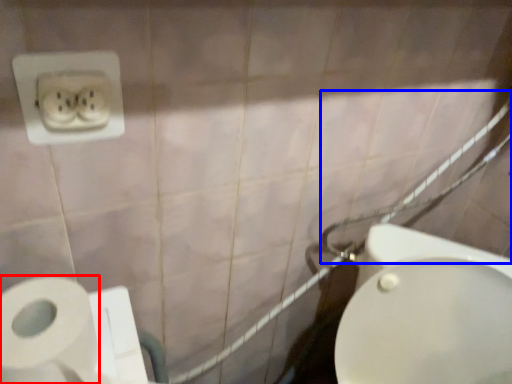
Question: Among these objects, which one is farthest to the camera, toilet paper (highlighted by a red box) or shower (highlighted by a blue box)?

Choices:
 (A) toilet paper
 (B) shower

Answer: (B)